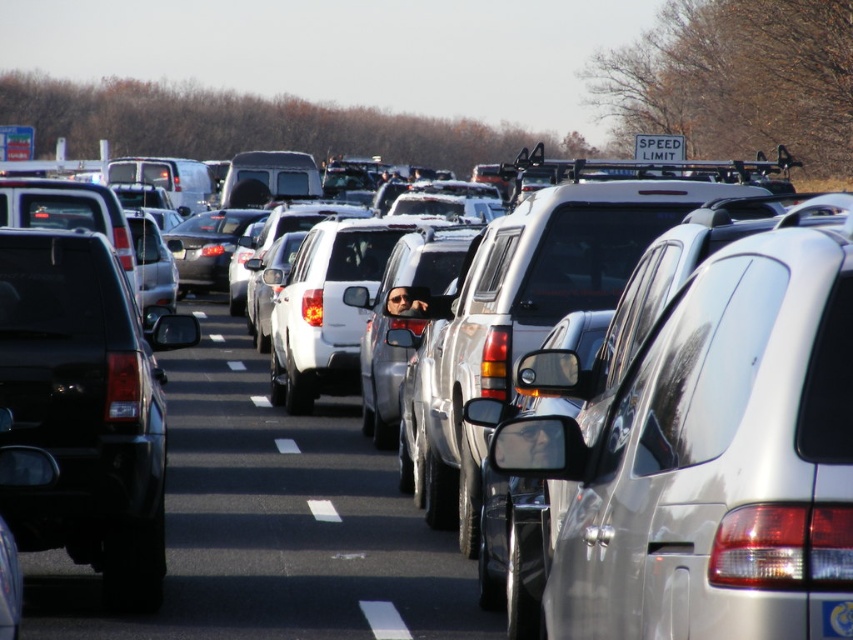
Which is below, matte black suv at left or black plastic license plate at center?

matte black suv at left is lower down.

At what (x,y) coordinates should I click in order to perform the action: click on matte black suv at left. Please return your answer as a coordinate pair (x, y). This screenshot has height=640, width=853. Looking at the image, I should click on coord(86,406).

Is white glossy car at center bigger than matte black suv at left?

Indeed, white glossy car at center has a larger size compared to matte black suv at left.

Which of these two, white glossy car at center or matte black suv at left, stands shorter?

With less height is white glossy car at center.

Is point (312, 488) positioned in front of point (106, 602)?

No, (312, 488) is behind (106, 602).

Image resolution: width=853 pixels, height=640 pixels. What are the coordinates of `white glossy car at center` in the screenshot? It's located at (283, 509).

Who is more distant from viewer, (325, 589) or (119, 417)?

Positioned behind is point (325, 589).

Can you confirm if white glossy car at center is smaller than black plastic license plate at center?

No, white glossy car at center is not smaller than black plastic license plate at center.

Find the location of a particular element. The height and width of the screenshot is (640, 853). white glossy car at center is located at coordinates (283, 509).

This screenshot has height=640, width=853. What are the coordinates of `white glossy car at center` in the screenshot? It's located at (283, 509).